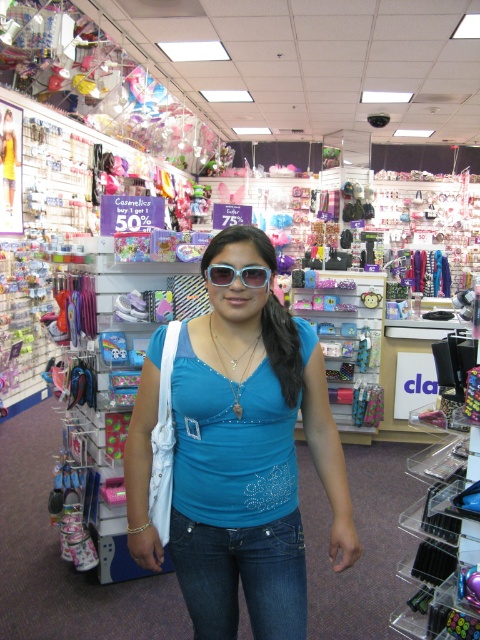
Question: Is matte blue blouse at center to the right of gold metallic necklace at center from the viewer's perspective?

Choices:
 (A) yes
 (B) no

Answer: (B)

Question: Which point is closer to the camera?

Choices:
 (A) (205, 364)
 (B) (240, 410)
 (C) (235, 275)

Answer: (C)

Question: Considering the real-world distances, which object is farthest from the translucent plastic sunglasses at center?

Choices:
 (A) dark blue denim jeans at center
 (B) gold metallic necklace at center

Answer: (A)

Question: Does dark blue denim jeans at center have a greater width compared to gold metallic necklace at center?

Choices:
 (A) no
 (B) yes

Answer: (B)

Question: Is translucent plastic sunglasses at center to the right of gold metallic necklace at center from the viewer's perspective?

Choices:
 (A) yes
 (B) no

Answer: (B)

Question: Which object appears farthest from the camera in this image?

Choices:
 (A) gold metallic necklace at center
 (B) dark blue denim jeans at center

Answer: (B)